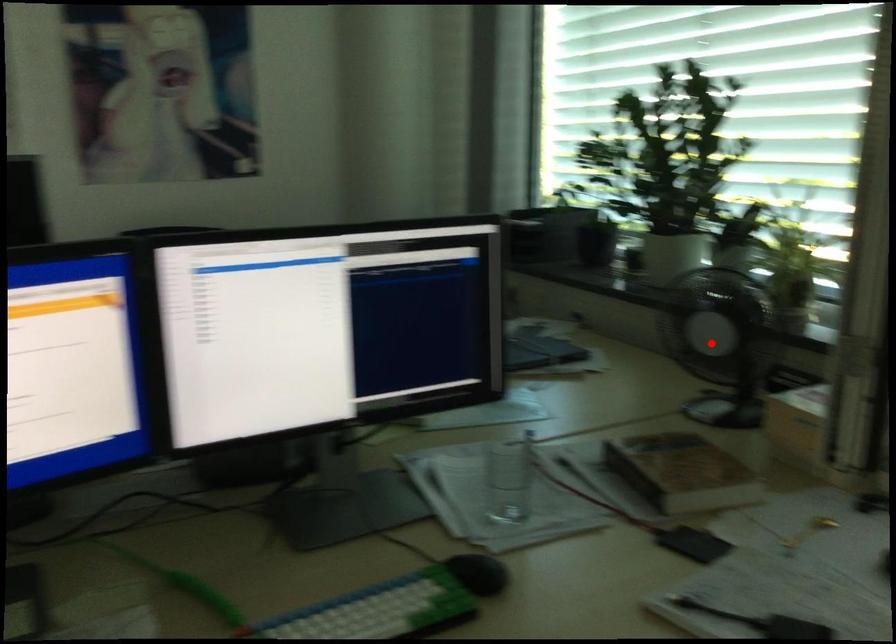
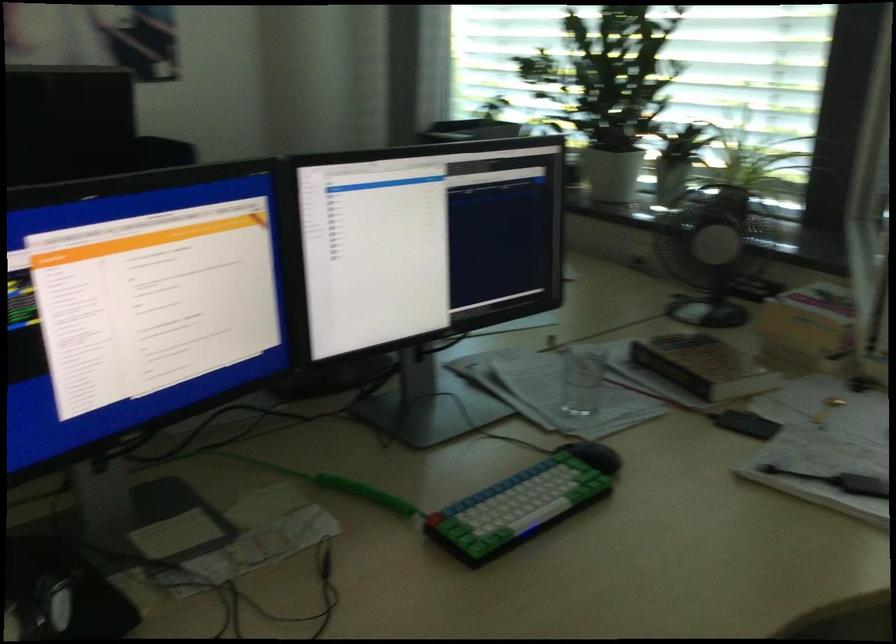
Question: I am providing you with two images of the same scene from different viewpoints. In image1, a red point is highlighted. Considering the same 3D point in image2, which of the following is correct?

Choices:
 (A) It is closer
 (B) It is farther

Answer: (B)